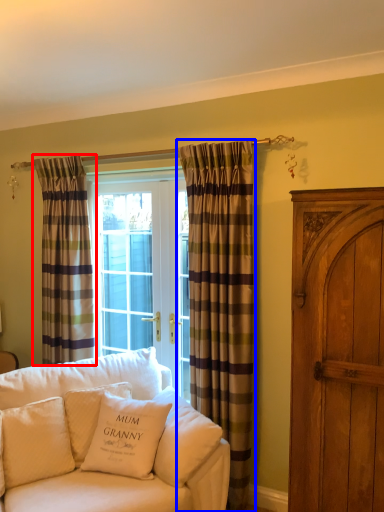
Question: Which object is closer to the camera taking this photo, curtain (highlighted by a red box) or curtain (highlighted by a blue box)?

Choices:
 (A) curtain
 (B) curtain

Answer: (B)